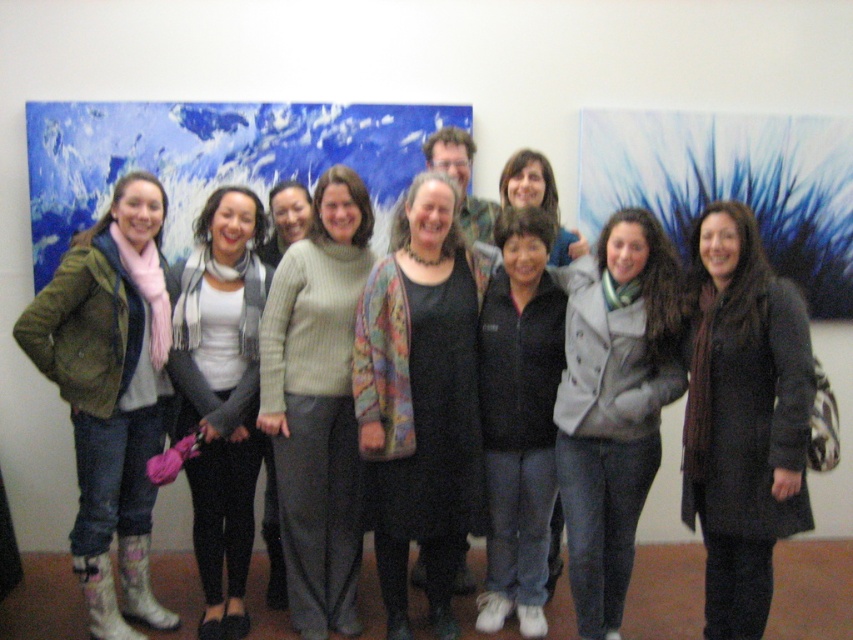
What are the coordinates of `white soft scarf at center` in the screenshot? It's located at (221, 394).

The width and height of the screenshot is (853, 640). What are the coordinates of `white soft scarf at center` in the screenshot? It's located at (221, 394).

Locate an element on the screen. The width and height of the screenshot is (853, 640). white soft scarf at center is located at coordinates (221, 394).

Which is below, matte green jacket at left or light green sweater at center?

Positioned lower is matte green jacket at left.

Does point (106, 314) come farther from viewer compared to point (293, 188)?

No, (106, 314) is closer to viewer.

Between point (74, 563) and point (276, 260), which one is positioned behind?

The point (276, 260) is more distant.

This screenshot has height=640, width=853. In order to click on matte green jacket at left in this screenshot , I will do `click(111, 392)`.

Which is more to the left, gray wool coat at center or knit sweater at center?

knit sweater at center

Looking at this image, is gray wool coat at center to the left of knit sweater at center from the viewer's perspective?

Incorrect, gray wool coat at center is not on the left side of knit sweater at center.

Between point (608, 262) and point (297, 400), which one is positioned in front?

Positioned in front is point (608, 262).

What are the coordinates of `gray wool coat at center` in the screenshot? It's located at (613, 403).